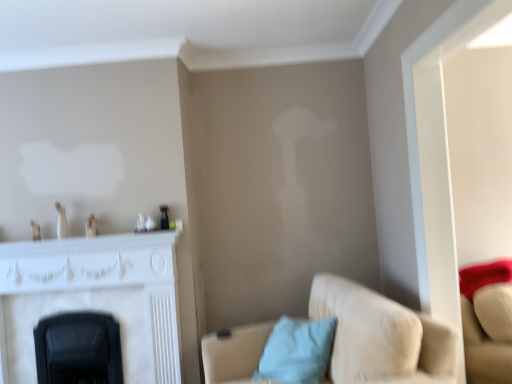
Where is `suede beige couch at lower right`? The height and width of the screenshot is (384, 512). suede beige couch at lower right is located at coordinates (381, 337).

The width and height of the screenshot is (512, 384). Find the location of `suede beige couch at lower right`. suede beige couch at lower right is located at coordinates (381, 337).

From the image's perspective, is white marble fireplace at left over light blue fabric pillow at lower center?

Yes, from the image's perspective, white marble fireplace at left is on top of light blue fabric pillow at lower center.

Considering the sizes of white marble fireplace at left and light blue fabric pillow at lower center in the image, is white marble fireplace at left taller or shorter than light blue fabric pillow at lower center?

In the image, white marble fireplace at left appears to be taller than light blue fabric pillow at lower center.

Who is bigger, white marble fireplace at left or light blue fabric pillow at lower center?

white marble fireplace at left.

Is white marble fireplace at left in front of light blue fabric pillow at lower center?

No, the depth of white marble fireplace at left is greater than that of light blue fabric pillow at lower center.

From the image's perspective, is suede beige couch at lower right under white marble fireplace at left?

Yes.

Considering the positions of point (432, 322) and point (147, 350), is point (432, 322) closer or farther from the camera than point (147, 350)?

Point (432, 322) appears to be closer to the viewer than point (147, 350).

Can you confirm if suede beige couch at lower right is smaller than white marble fireplace at left?

No, suede beige couch at lower right is not smaller than white marble fireplace at left.

Looking at their sizes, would you say suede beige couch at lower right is wider or thinner than white marble fireplace at left?

Clearly, suede beige couch at lower right has more width compared to white marble fireplace at left.

You are a GUI agent. You are given a task and a screenshot of the screen. Output one action in this format:
    pyautogui.click(x=<x>, y=<y>)
    Task: Click on the pillow that is on the right side of white marble fireplace at left
    Image resolution: width=512 pixels, height=384 pixels.
    Given the screenshot: What is the action you would take?
    pyautogui.click(x=297, y=351)

Considering the sizes of light blue fabric pillow at lower center and white marble fireplace at left in the image, is light blue fabric pillow at lower center taller or shorter than white marble fireplace at left?

light blue fabric pillow at lower center is shorter than white marble fireplace at left.

From a real-world perspective, is light blue fabric pillow at lower center positioned above or below white marble fireplace at left?

light blue fabric pillow at lower center is situated lower than white marble fireplace at left in the real world.

How far apart are white marble fireplace at left and suede beige couch at lower right?

A distance of 1.29 meters exists between white marble fireplace at left and suede beige couch at lower right.

Is white marble fireplace at left positioned with its back to suede beige couch at lower right?

white marble fireplace at left is not turned away from suede beige couch at lower right.

Considering the positions of point (172, 382) and point (226, 365), is point (172, 382) closer or farther from the camera than point (226, 365)?

Point (172, 382).

Find the location of a particular element. Image resolution: width=512 pixels, height=384 pixels. fireplace above the suede beige couch at lower right (from the image's perspective) is located at coordinates (94, 299).

Is light blue fabric pillow at lower center directly adjacent to suede beige couch at lower right?

There is a gap between light blue fabric pillow at lower center and suede beige couch at lower right.

From a real-world perspective, who is located higher, light blue fabric pillow at lower center or suede beige couch at lower right?

light blue fabric pillow at lower center, from a real-world perspective.

Is light blue fabric pillow at lower center facing towards suede beige couch at lower right?

Yes, light blue fabric pillow at lower center faces towards suede beige couch at lower right.

Does point (258, 369) come in front of point (210, 380)?

That is False.

How distant is suede beige couch at lower right from light blue fabric pillow at lower center?

9.41 inches.

From the image's perspective, would you say suede beige couch at lower right is shown under light blue fabric pillow at lower center?

Yes, from the image's perspective, suede beige couch at lower right is below light blue fabric pillow at lower center.

Choose the correct answer: Is suede beige couch at lower right inside light blue fabric pillow at lower center or outside it?

suede beige couch at lower right is not enclosed by light blue fabric pillow at lower center.

Which is more to the left, suede beige couch at lower right or light blue fabric pillow at lower center?

light blue fabric pillow at lower center.

The width and height of the screenshot is (512, 384). I want to click on pillow below the white marble fireplace at left (from the image's perspective), so click(297, 351).

I want to click on fireplace that is on the left side of suede beige couch at lower right, so click(x=94, y=299).

Considering their positions, is suede beige couch at lower right positioned further to white marble fireplace at left than light blue fabric pillow at lower center?

Based on the image, suede beige couch at lower right appears to be further to white marble fireplace at left.

Consider the image. When comparing their distances from light blue fabric pillow at lower center, does suede beige couch at lower right or white marble fireplace at left seem closer?

Among the two, suede beige couch at lower right is located nearer to light blue fabric pillow at lower center.

When comparing their distances from white marble fireplace at left, does light blue fabric pillow at lower center or suede beige couch at lower right seem further?

suede beige couch at lower right is further to white marble fireplace at left.

Estimate the real-world distances between objects in this image. Which object is closer to light blue fabric pillow at lower center, white marble fireplace at left or suede beige couch at lower right?

Among the two, suede beige couch at lower right is located nearer to light blue fabric pillow at lower center.

Estimate the real-world distances between objects in this image. Which object is closer to suede beige couch at lower right, white marble fireplace at left or light blue fabric pillow at lower center?

light blue fabric pillow at lower center lies closer to suede beige couch at lower right than the other object.

Which object lies further to the anchor point suede beige couch at lower right, light blue fabric pillow at lower center or white marble fireplace at left?

white marble fireplace at left.

You are a GUI agent. You are given a task and a screenshot of the screen. Output one action in this format:
    pyautogui.click(x=<x>, y=<y>)
    Task: Click on the pillow situated between white marble fireplace at left and suede beige couch at lower right from left to right
    The width and height of the screenshot is (512, 384).
    Given the screenshot: What is the action you would take?
    pyautogui.click(x=297, y=351)